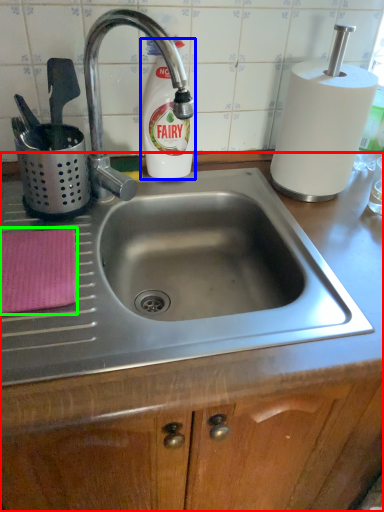
Question: Which is farther away from counter (highlighted by a red box)? cleaning product (highlighted by a blue box) or cloth (highlighted by a green box)?

Choices:
 (A) cleaning product
 (B) cloth

Answer: (A)